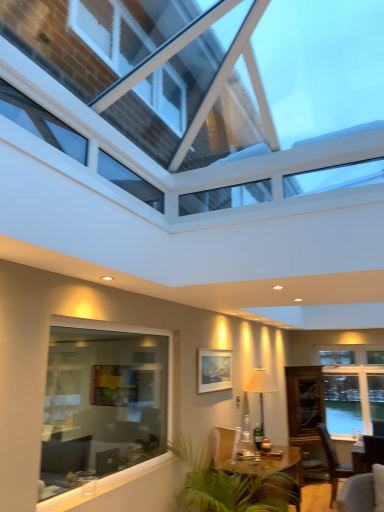
You are a GUI agent. You are given a task and a screenshot of the screen. Output one action in this format:
    pyautogui.click(x=<x>, y=<y>)
    Task: Click on the brown wooden chair at lower right
    This screenshot has width=384, height=512.
    Given the screenshot: What is the action you would take?
    pyautogui.click(x=333, y=461)

The image size is (384, 512). I want to click on wooden table at center, so click(x=268, y=463).

Describe the element at coordinates (212, 70) in the screenshot. This screenshot has height=512, width=384. I see `transparent glass roof at upper center, the 3th window from the back` at that location.

At what (x,y) coordinates should I click in order to perform the action: click on transparent glass cabinet at right. Please return your answer as a coordinate pair (x, y). Looking at the image, I should click on (305, 410).

You are a GUI agent. You are given a task and a screenshot of the screen. Output one action in this format:
    pyautogui.click(x=<x>, y=<y>)
    Task: Click on the wooden armchair at center
    The width and height of the screenshot is (384, 512).
    Given the screenshot: What is the action you would take?
    pyautogui.click(x=226, y=444)

The image size is (384, 512). What do you see at coordinates (260, 388) in the screenshot?
I see `matte white lamp at center` at bounding box center [260, 388].

At what (x,y) coordinates should I click in order to perform the action: click on white glass window at right, which is the 3th window in front-to-back order. Please return your answer as a coordinate pair (x, y). Looking at the image, I should click on (352, 390).

Identify the location of brown wooden chair at lower right. (333, 461).

Is wooden table at center not within clear glass window at lower left, which is the 2th window in back-to-front order?

That's correct, wooden table at center is outside of clear glass window at lower left, which is the 2th window in back-to-front order.

Can you confirm if wooden table at center is shorter than clear glass window at lower left, which is the second window in front-to-back order?

Yes, wooden table at center is shorter than clear glass window at lower left, which is the second window in front-to-back order.

From the image's perspective, between wooden table at center and clear glass window at lower left, which is the 2th window in back-to-front order, who is located below?

wooden table at center appears lower in the image.

Considering the sizes of white glass window at right, which is the 3th window in front-to-back order, and wooden armchair at center in the image, is white glass window at right, which is the 3th window in front-to-back order, wider or thinner than wooden armchair at center?

Considering their sizes, white glass window at right, which is the 3th window in front-to-back order, looks slimmer than wooden armchair at center.

Would you consider white glass window at right, which is the 3th window in front-to-back order, to be distant from wooden armchair at center?

That's right, there is a large distance between white glass window at right, which is the 3th window in front-to-back order, and wooden armchair at center.

Is point (379, 378) positioned in front of point (222, 449)?

No, it is behind (222, 449).

Is white glass window at right, the first window in the back-to-front sequence, shorter than wooden armchair at center?

In fact, white glass window at right, the first window in the back-to-front sequence, may be taller than wooden armchair at center.

Which of these two, wooden armchair at center or white glass window at right, which is the 3th window in front-to-back order, stands taller?

white glass window at right, which is the 3th window in front-to-back order.

Starting from the wooden armchair at center, which window is the 2nd one to the right? Please provide its 2D coordinates.

[(352, 390)]

Looking at their sizes, would you say wooden armchair at center is wider or thinner than white glass window at right, which is the 3th window in front-to-back order?

wooden armchair at center is wider than white glass window at right, which is the 3th window in front-to-back order.

Can you confirm if wooden armchair at center is bigger than white glass window at right, the first window in the back-to-front sequence?

No, wooden armchair at center is not bigger than white glass window at right, the first window in the back-to-front sequence.

Can you confirm if wooden armchair at center is shorter than transparent glass roof at upper center, the 1th window when ordered from front to back?

Incorrect, the height of wooden armchair at center does not fall short of that of transparent glass roof at upper center, the 1th window when ordered from front to back.

Is wooden armchair at center positioned in front of transparent glass roof at upper center, the 1th window when ordered from front to back?

No, wooden armchair at center is behind transparent glass roof at upper center, the 1th window when ordered from front to back.

Considering the points (221, 454) and (212, 62), which point is in front, point (221, 454) or point (212, 62)?

Point (212, 62)

Are wooden armchair at center and transparent glass roof at upper center, the 3th window from the back, beside each other?

wooden armchair at center and transparent glass roof at upper center, the 3th window from the back, are clearly separated.

From a real-world perspective, is white glass window at right, which is the 3th window in front-to-back order, beneath brown wooden chair at lower right?

No, from a real-world perspective, white glass window at right, which is the 3th window in front-to-back order, is not beneath brown wooden chair at lower right.

Identify the location of window on the right side of brown wooden chair at lower right. This screenshot has width=384, height=512. (352, 390).

Choose the correct answer: Is white glass window at right, the first window in the back-to-front sequence, inside brown wooden chair at lower right or outside it?

white glass window at right, the first window in the back-to-front sequence, is located beyond the bounds of brown wooden chair at lower right.

Is matte white lamp at center with brown wooden chair at lower right?

No, matte white lamp at center is not in contact with brown wooden chair at lower right.

Looking at this image, from the image's perspective, which is below, matte white lamp at center or brown wooden chair at lower right?

brown wooden chair at lower right.

Would you say matte white lamp at center is to the left or to the right of brown wooden chair at lower right in the picture?

From the image, it's evident that matte white lamp at center is to the left of brown wooden chair at lower right.

Can you confirm if matte white lamp at center is wider than brown wooden chair at lower right?

No, matte white lamp at center is not wider than brown wooden chair at lower right.

Between transparent glass cabinet at right and clear glass window at lower left, which is the second window in front-to-back order, which one has more height?

Standing taller between the two is transparent glass cabinet at right.

Which of these two, transparent glass cabinet at right or clear glass window at lower left, which is the second window in front-to-back order, is bigger?

Bigger between the two is transparent glass cabinet at right.

Which object is further away from the camera, transparent glass cabinet at right or clear glass window at lower left, which is the 2th window in back-to-front order?

transparent glass cabinet at right.

Does transparent glass cabinet at right have a lesser width compared to clear glass window at lower left, which is the second window in front-to-back order?

No, transparent glass cabinet at right is not thinner than clear glass window at lower left, which is the second window in front-to-back order.

From the image's perspective, which window is the 2nd one above the wooden table at center? Please provide its 2D coordinates.

[(103, 409)]

There is a wooden armchair at center. Identify the location of the 1st window above it (from a real-world perspective). (352, 390).

Considering their positions, is transparent glass roof at upper center, the 3th window from the back, positioned closer to clear glass window at lower left, which is the 2th window in back-to-front order, than transparent glass cabinet at right?

transparent glass roof at upper center, the 3th window from the back, is closer to clear glass window at lower left, which is the 2th window in back-to-front order.

In the scene shown: Which object lies nearer to the anchor point wooden table at center, wooden armchair at center or clear glass window at lower left, which is the second window in front-to-back order?

wooden armchair at center.

From the image, which object appears to be nearer to clear glass window at lower left, which is the 2th window in back-to-front order, transparent glass roof at upper center, the 1th window when ordered from front to back, or matte white lamp at center?

matte white lamp at center lies closer to clear glass window at lower left, which is the 2th window in back-to-front order, than the other object.

When comparing their distances from matte white lamp at center, does brown wooden chair at lower right or white glass window at right, the first window in the back-to-front sequence, seem closer?

Based on the image, white glass window at right, the first window in the back-to-front sequence, appears to be nearer to matte white lamp at center.

Looking at the image, which one is located further to wooden armchair at center, matte white lamp at center or clear glass window at lower left, which is the second window in front-to-back order?

clear glass window at lower left, which is the second window in front-to-back order.

Looking at this image, looking at the image, which one is located further to wooden table at center, clear glass window at lower left, which is the 2th window in back-to-front order, or transparent glass cabinet at right?

The object further to wooden table at center is transparent glass cabinet at right.

From the image, which object appears to be farther from wooden table at center, transparent glass cabinet at right or clear glass window at lower left, which is the 2th window in back-to-front order?

transparent glass cabinet at right lies further to wooden table at center than the other object.

Looking at this image, looking at the image, which one is located further to transparent glass roof at upper center, the 3th window from the back, white glass window at right, the first window in the back-to-front sequence, or clear glass window at lower left, which is the second window in front-to-back order?

white glass window at right, the first window in the back-to-front sequence.

The width and height of the screenshot is (384, 512). I want to click on lamp between wooden armchair at center and brown wooden chair at lower right from left to right, so click(x=260, y=388).

I want to click on lamp between wooden table at center and transparent glass cabinet at right in the front-back direction, so click(x=260, y=388).

Image resolution: width=384 pixels, height=512 pixels. In order to click on window positioned between transparent glass roof at upper center, the 1th window when ordered from front to back, and transparent glass cabinet at right from near to far in this screenshot , I will do [x=103, y=409].

At what (x,y) coordinates should I click in order to perform the action: click on glass door between matte white lamp at center and white glass window at right, which is the 3th window in front-to-back order, along the z-axis. Please return your answer as a coordinate pair (x, y). The image size is (384, 512). Looking at the image, I should click on (305, 410).